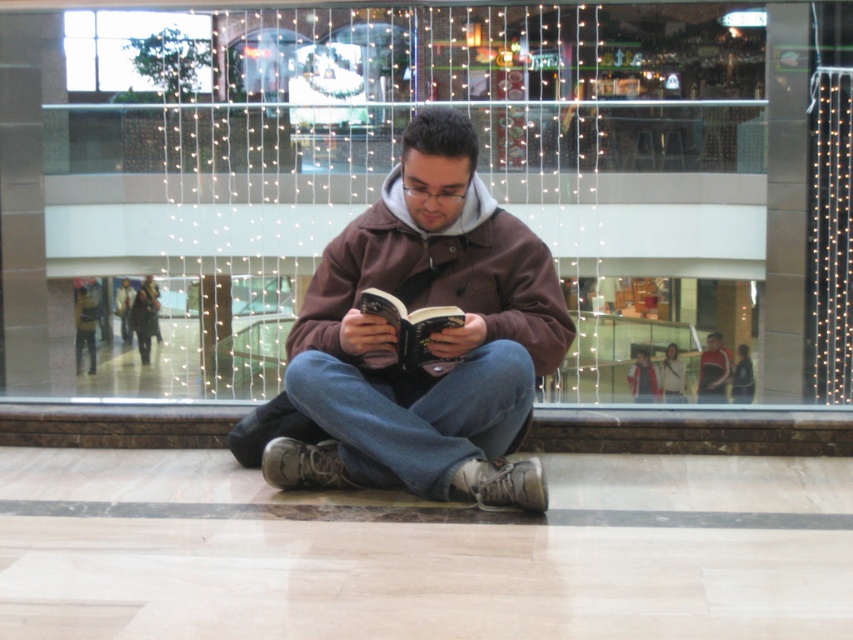
Identify the location of brown soft hoodie at center. This screenshot has width=853, height=640. (428, 339).

Is brown soft hoodie at center above hardcover book at center?

Correct, brown soft hoodie at center is located above hardcover book at center.

Between point (294, 458) and point (462, 314), which one is positioned in front?

Point (462, 314)

Locate an element on the screen. This screenshot has width=853, height=640. brown soft hoodie at center is located at coordinates (428, 339).

Does hardcover book at center have a lesser height compared to matte black jacket at center?

Yes.

Measure the distance between hardcover book at center and camera.

They are 4.34 meters apart.

Does point (410, 317) come in front of point (717, 369)?

Yes, point (410, 317) is in front of point (717, 369).

Identify the location of hardcover book at center. This screenshot has width=853, height=640. (409, 332).

Is brown soft hoodie at center above matte black jacket at center?

Indeed, brown soft hoodie at center is positioned over matte black jacket at center.

Locate an element on the screen. Image resolution: width=853 pixels, height=640 pixels. brown soft hoodie at center is located at coordinates (428, 339).

Where is `brown soft hoodie at center`? The height and width of the screenshot is (640, 853). brown soft hoodie at center is located at coordinates (428, 339).